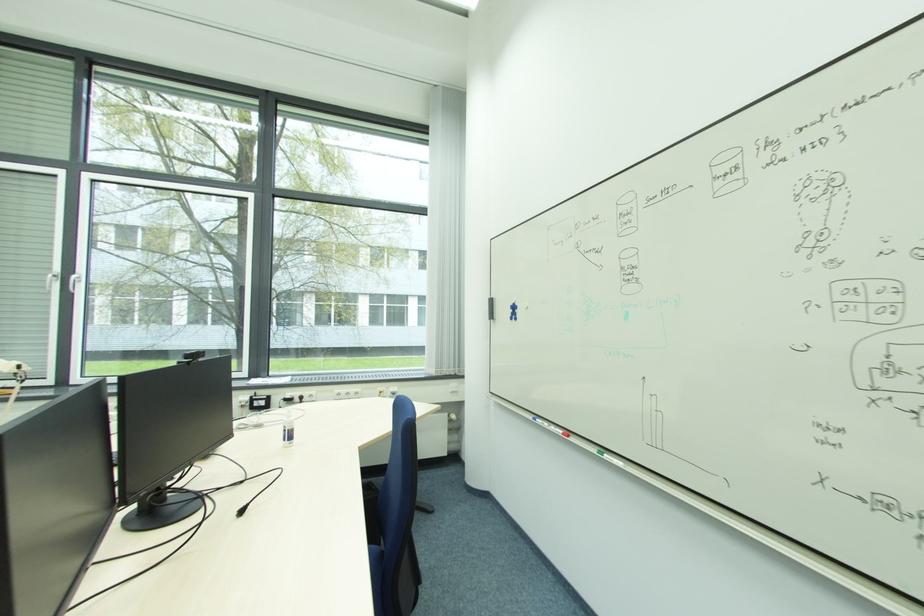
At what (x,y) coordinates should I click in order to perform the action: click on chair sitting surface. Please return your answer as a coordinate pair (x, y). The height and width of the screenshot is (616, 924). Looking at the image, I should click on (380, 581).